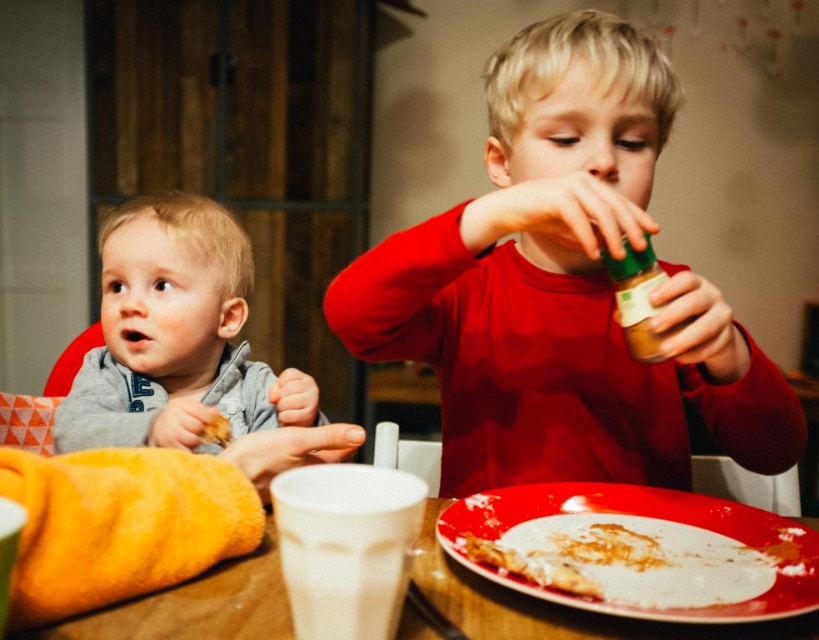
Question: Estimate the real-world distances between objects in this image. Which object is closer to the green matte jar at upper right?

Choices:
 (A) matte red shirt at center
 (B) white glossy plate at lower center
 (C) gray soft fabric toddler at left
 (D) wooden table at center

Answer: (A)

Question: Can you confirm if gray soft fabric toddler at left is thinner than wooden table at center?

Choices:
 (A) no
 (B) yes

Answer: (A)

Question: Which of the following is the farthest from the observer?

Choices:
 (A) (663, 337)
 (B) (243, 589)
 (C) (698, 602)

Answer: (A)

Question: From the image, what is the correct spatial relationship of matte red shirt at center in relation to green matte jar at upper right?

Choices:
 (A) right
 (B) left

Answer: (B)

Question: Does matte red shirt at center appear on the left side of wooden table at center?

Choices:
 (A) yes
 (B) no

Answer: (B)

Question: Which object is closer to the camera taking this photo?

Choices:
 (A) wooden table at center
 (B) white glossy plate at lower center
 (C) matte red shirt at center

Answer: (A)